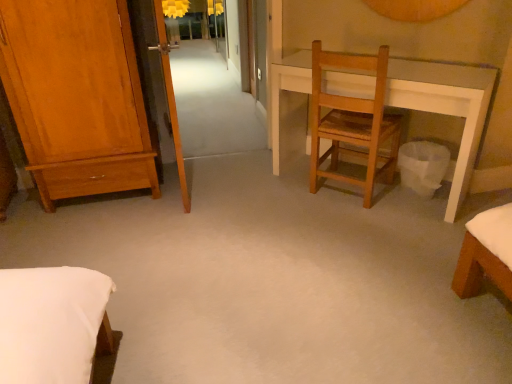
This screenshot has width=512, height=384. Identify the location of space that is in front of shiny brown wardrobe at left. (94, 242).